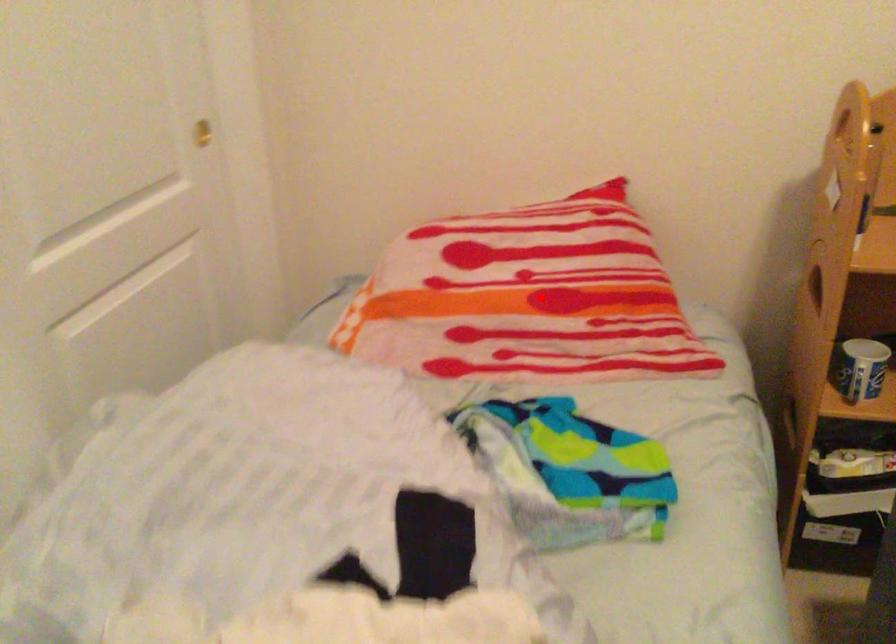
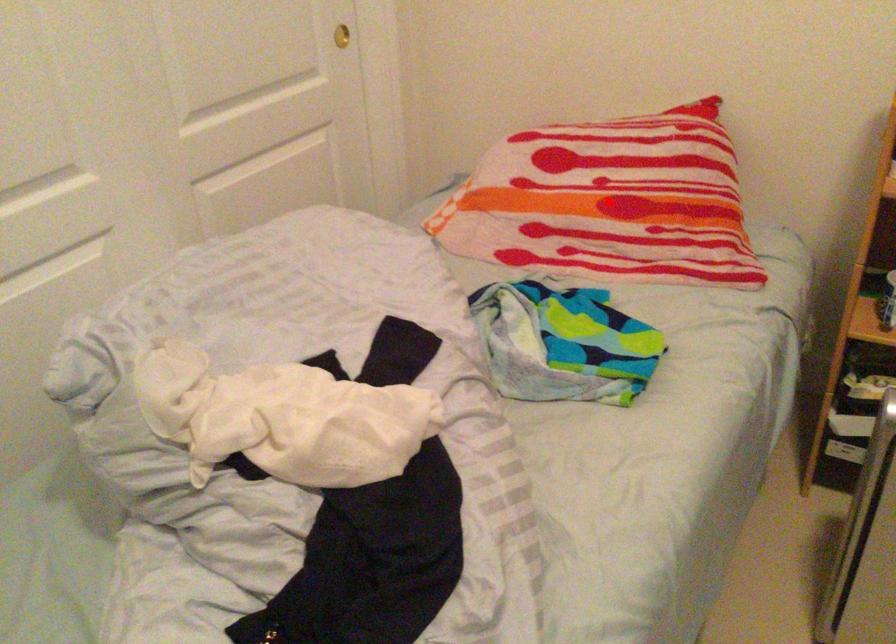
I am providing you with two images of the same scene from different viewpoints. A red point is marked on the first image and another point is marked on the second image. Does the point marked in image1 correspond to the same location as the one in image2?

Yes